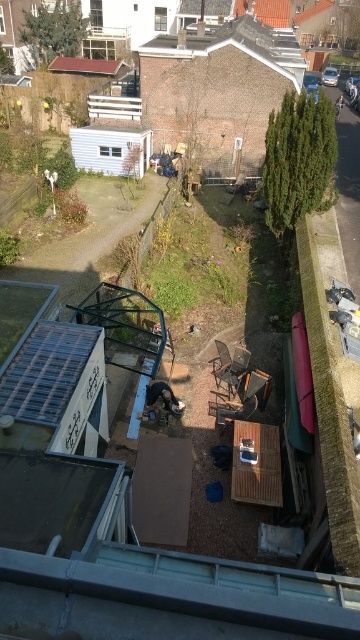
You are standing on the balcony of the house and want to place a new plant pot exactly where the red tile roof at upper center is located. What coordinates should you aim for?

The coordinates for the red tile roof at upper center are 0.103 in the horizontal axis and 0.239 in the vertical axis.

You are standing on the balcony and looking out at the backyard. You notice both the brown shingles at upper center and the red tile roof at upper center. Which one is closer to you?

The brown shingles at upper center are closer to you than the red tile roof at upper center.

You are standing on the balcony looking down at the backyard. Where exactly is the brown shingles at upper center located in terms of coordinates?

The brown shingles at upper center are located at coordinates point (236, 45).